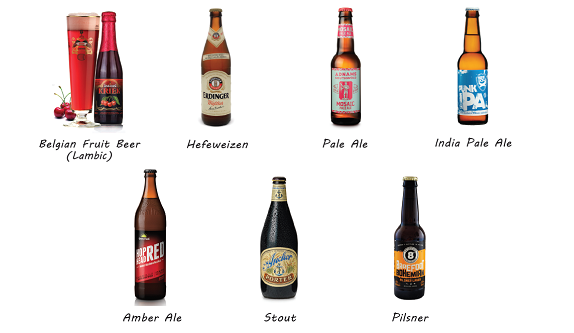
Where is `beer glass`? This screenshot has width=574, height=333. beer glass is located at coordinates (82, 74).